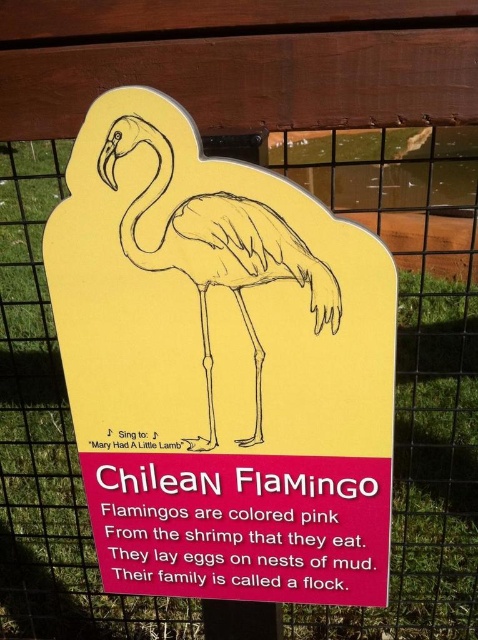
Can you confirm if yellow cardboard sign at center is wider than pink paper flamingo at center?

Indeed, yellow cardboard sign at center has a greater width compared to pink paper flamingo at center.

Does yellow cardboard sign at center lie behind pink paper flamingo at center?

No.

The height and width of the screenshot is (640, 478). Describe the element at coordinates (220, 368) in the screenshot. I see `yellow cardboard sign at center` at that location.

This screenshot has height=640, width=478. Find the location of `yellow cardboard sign at center`. yellow cardboard sign at center is located at coordinates (220, 368).